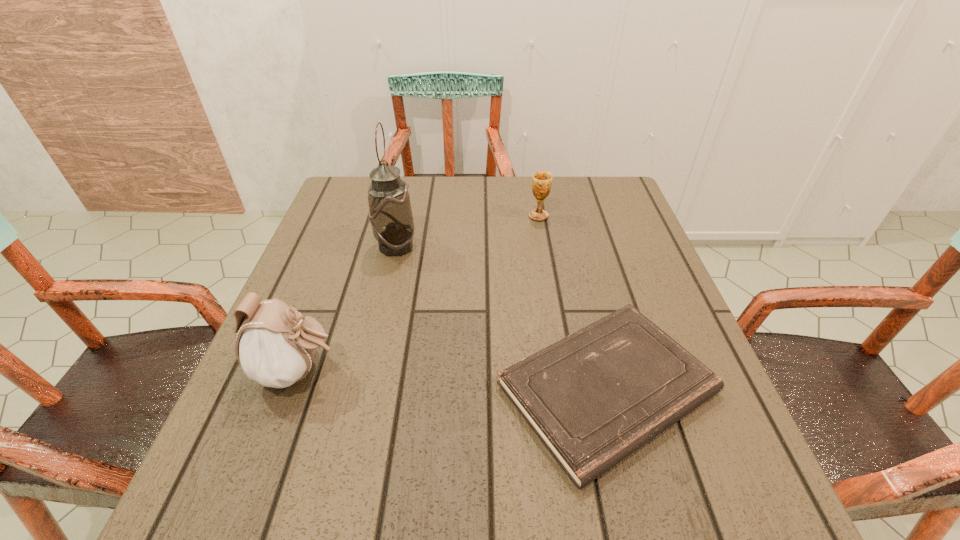
Identify the location of the tallest object. (390, 215).

The height and width of the screenshot is (540, 960). Find the location of `the second farthest object`. the second farthest object is located at coordinates (390, 215).

Locate an element on the screen. This screenshot has height=540, width=960. the second tallest object is located at coordinates (275, 347).

Image resolution: width=960 pixels, height=540 pixels. Find the location of `chalice`. chalice is located at coordinates (541, 184).

Locate an element on the screen. the third tallest object is located at coordinates (541, 184).

You are a GUI agent. You are given a task and a screenshot of the screen. Output one action in this format:
    pyautogui.click(x=<x>, y=<y>)
    Task: Click on the shortest object
    The image size is (960, 540).
    Given the screenshot: What is the action you would take?
    pyautogui.click(x=594, y=397)

At what (x,y) coordinates should I click in order to perform the action: click on vacant space located 0.150m on the right of the second farthest object. Please return your answer as a coordinate pair (x, y). The image size is (960, 540). Looking at the image, I should click on (478, 247).

Locate an element on the screen. This screenshot has height=540, width=960. vacant region located 0.100m on the front-facing side of the second tallest object is located at coordinates (398, 371).

You are a GUI agent. You are given a task and a screenshot of the screen. Output one action in this format:
    pyautogui.click(x=<x>, y=<y>)
    Task: Click on the vacant space located 0.370m on the front of the second shortest object
    
    Given the screenshot: What is the action you would take?
    pyautogui.click(x=559, y=329)

Locate an element on the screen. vacant space located 0.160m on the left of the paperback book is located at coordinates (405, 388).